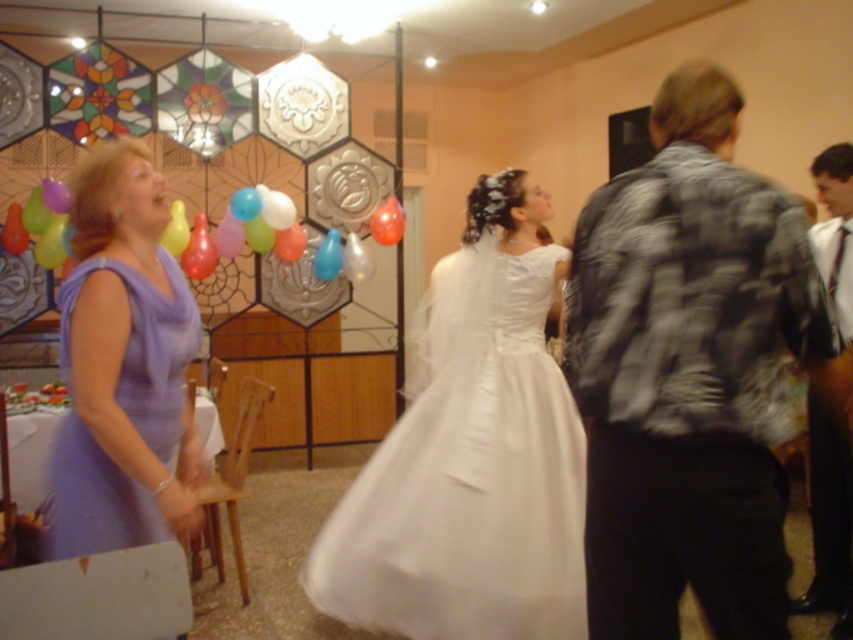
You are a photographer at the wedding reception. You need to position yourself so that both the translucent plastic balloon at center and the blue glossy balloon at center are visible in your shot. Which balloon should you place closer to the left side of your camera frame?

The blue glossy balloon at center should be placed closer to the left side of your camera frame because the translucent plastic balloon at center is to the right of it.

You are a photographer at the wedding reception. You need to capture a photo where both the plaid fabric jacket at right and the satin white dress at center are clearly visible. Based on their positions, which object should you focus on first to ensure both are in sharp focus?

You should focus on the plaid fabric jacket at right first because it is closer to the viewer than the satin white dress at center. By focusing on the closer object, the depth of field may naturally include the farther object in acceptable focus.